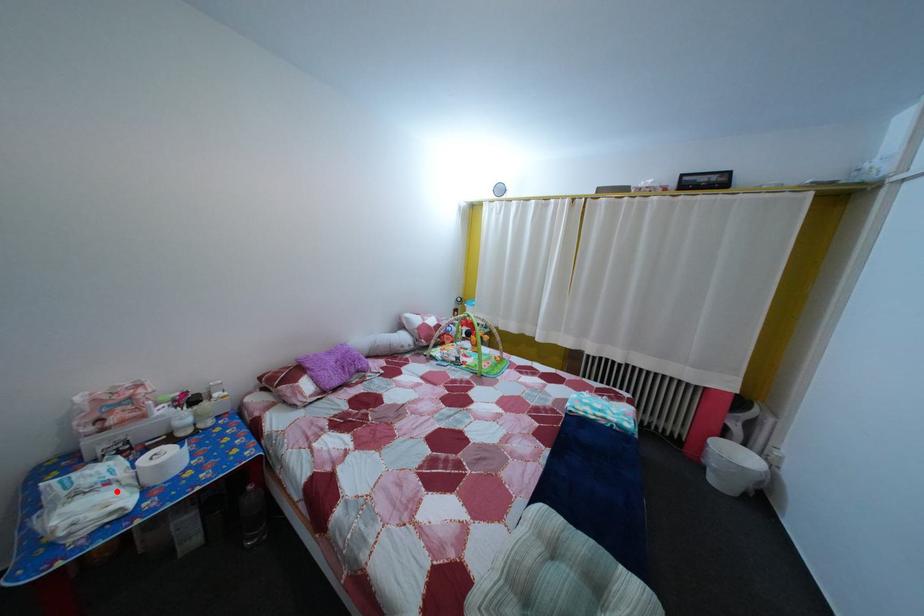
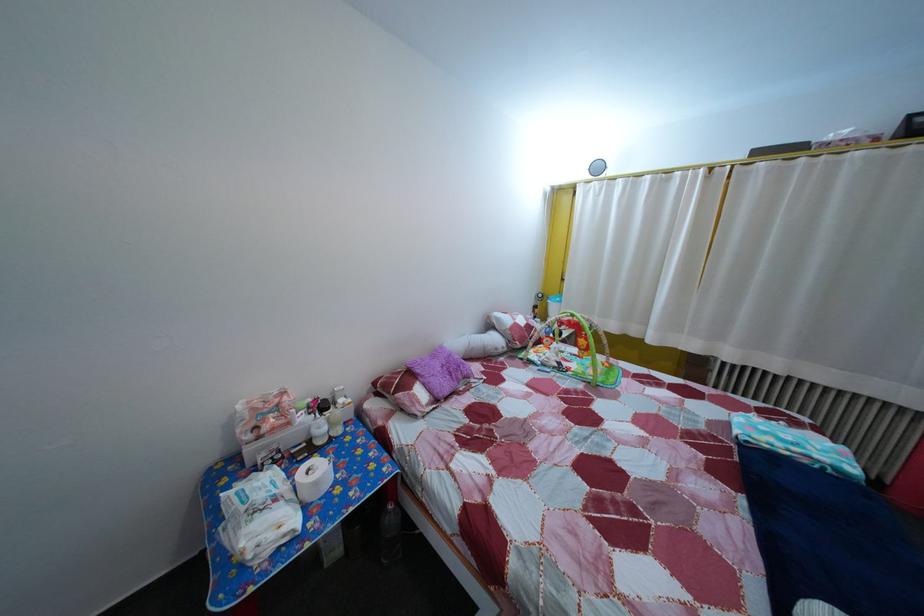
Where in the second image is the point corresponding to the highlighted location from the first image?

(285, 508)